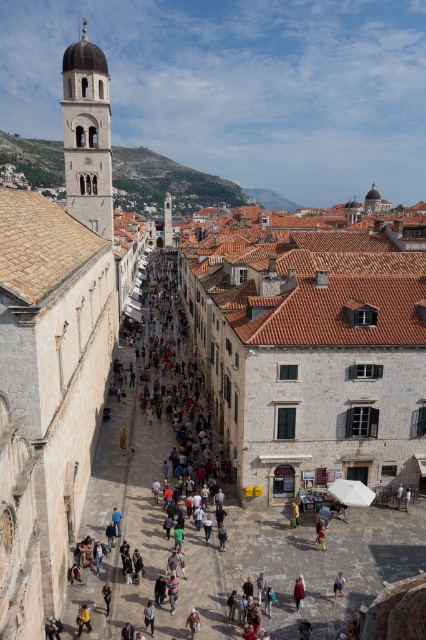
Is red wool coat at lower center positioned in front of light blue denim jeans at lower center?

Yes.

Which is more to the right, red wool coat at lower center or light blue denim jeans at lower center?

light blue denim jeans at lower center

What do you see at coordinates (298, 593) in the screenshot? I see `red wool coat at lower center` at bounding box center [298, 593].

In order to click on red wool coat at lower center in this screenshot , I will do `click(298, 593)`.

Who is more distant from viewer, (83, 612) or (342, 579)?

Positioned behind is point (342, 579).

Can you confirm if yellow fabric person at center is wider than light blue denim jeans at lower center?

Yes, yellow fabric person at center is wider than light blue denim jeans at lower center.

Where is `yellow fabric person at center`? This screenshot has width=426, height=640. yellow fabric person at center is located at coordinates (83, 620).

Does smooth stone tower at center have a smaller size compared to dark gray fabric jacket at lower center?

No, smooth stone tower at center is not smaller than dark gray fabric jacket at lower center.

Does smooth stone tower at center lie behind dark gray fabric jacket at lower center?

That is True.

The width and height of the screenshot is (426, 640). Describe the element at coordinates (166, 220) in the screenshot. I see `smooth stone tower at center` at that location.

This screenshot has width=426, height=640. I want to click on smooth stone tower at center, so click(166, 220).